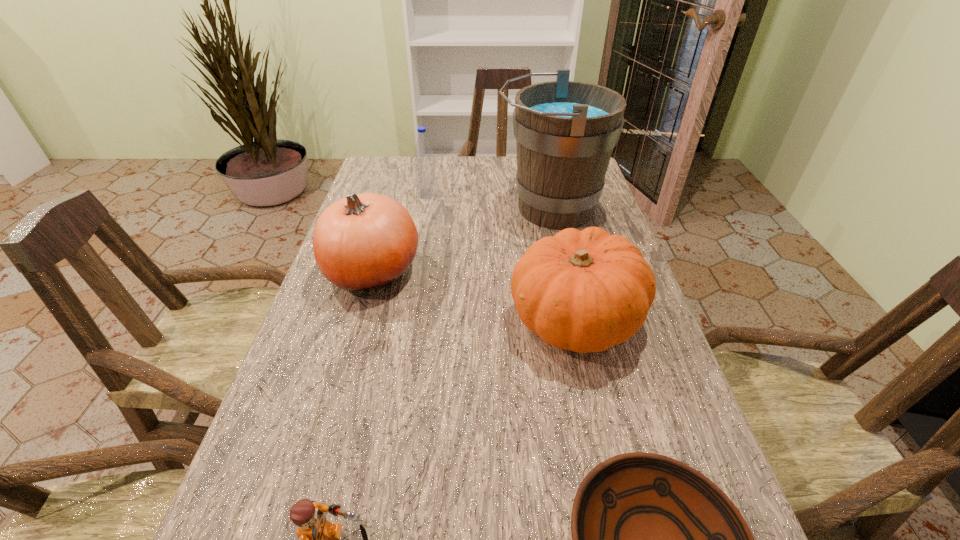
At what (x,y) coordinates should I click in order to perform the action: click on the tallest object. Please return your answer as a coordinate pair (x, y). Looking at the image, I should click on (565, 131).

Locate an element on the screen. The height and width of the screenshot is (540, 960). the taller pumpkin is located at coordinates (366, 241).

Find the location of `water bottle`. water bottle is located at coordinates (425, 175).

Find the location of a particular element. This screenshot has width=960, height=540. the shorter pumpkin is located at coordinates (585, 291).

You are a GUI agent. You are given a task and a screenshot of the screen. Output one action in this format:
    pyautogui.click(x=<x>, y=<y>)
    Task: Click on the vacant space located 0.060m with a handle on the side of the wine bucket
    
    Given the screenshot: What is the action you would take?
    pyautogui.click(x=475, y=208)

Identify the location of free region located 0.310m with a handle on the side of the wine bucket. The height and width of the screenshot is (540, 960). (389, 208).

I want to click on vacant space located 0.120m with a handle on the side of the wine bucket, so click(455, 208).

Identify the location of free space located 0.250m on the front of the left pumpkin. The image size is (960, 540). (336, 402).

Where is `free space located on the left of the water bottle`? free space located on the left of the water bottle is located at coordinates (381, 193).

Where is `free space located 0.180m on the front of the right pumpkin`? The image size is (960, 540). free space located 0.180m on the front of the right pumpkin is located at coordinates (608, 464).